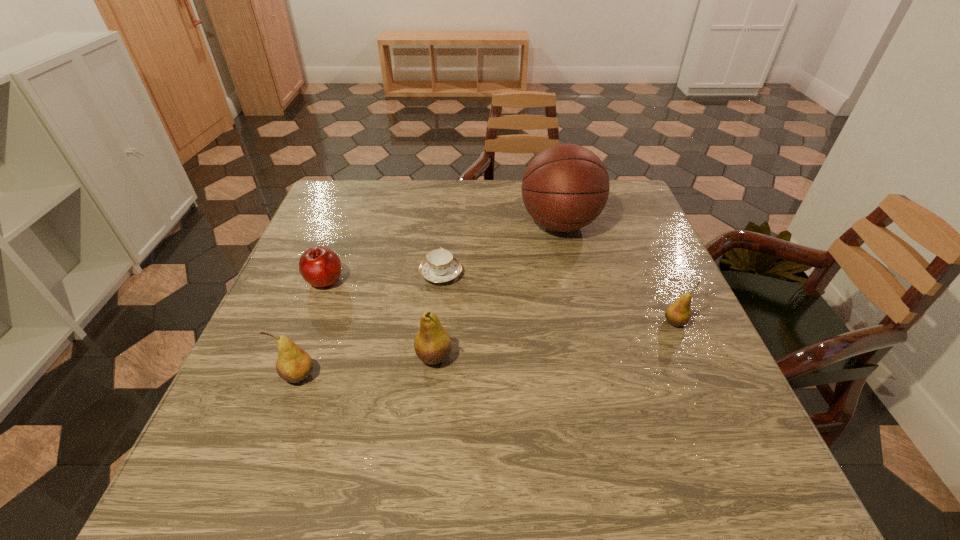
Please point a spot to place another pear for symmetrical spacing. Please provide its 2D coordinates. Your answer should be formatted as a tuple, i.e. [(x, y)], where the tuple contains the x and y coordinates of a point satisfying the conditions above.

[(559, 339)]